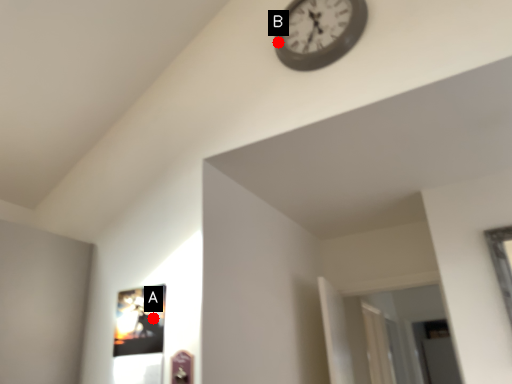
Question: Two points are circled on the image, labeled by A and B beside each circle. Which point appears closest to the camera in this image?

Choices:
 (A) A is closer
 (B) B is closer

Answer: (A)